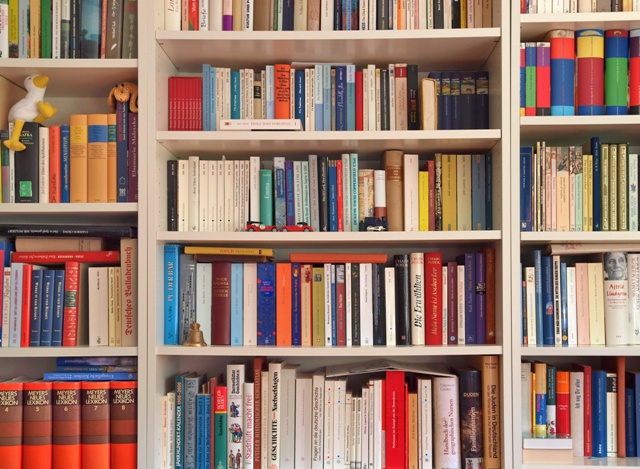
Find the location of a particular element. toys is located at coordinates (196, 336), (257, 227), (299, 224), (376, 225), (32, 97), (124, 89).